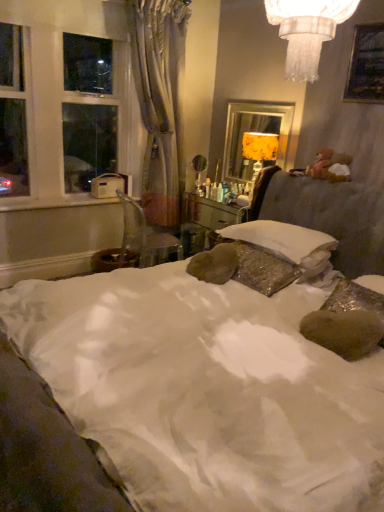
Question: Based on their positions, is white plastic window sill at left located to the left or right of gold textured lampshade at upper right?

Choices:
 (A) left
 (B) right

Answer: (A)

Question: From a real-world perspective, is white plastic window sill at left above or below gold textured lampshade at upper right?

Choices:
 (A) below
 (B) above

Answer: (A)

Question: Estimate the real-world distances between objects in this image. Which object is closer to the white satin bed at center?

Choices:
 (A) gold textured lampshade at upper right
 (B) white soft pillow at center
 (C) transparent plastic chair at center
 (D) silvery drapery at left
 (E) white plastic window sill at left

Answer: (B)

Question: Based on their relative distances, which object is nearer to the silvery drapery at left?

Choices:
 (A) white plastic window frame at left
 (B) gold textured lampshade at upper right
 (C) white satin bed at center
 (D) white soft pillow at center
 (E) transparent plastic chair at center

Answer: (A)